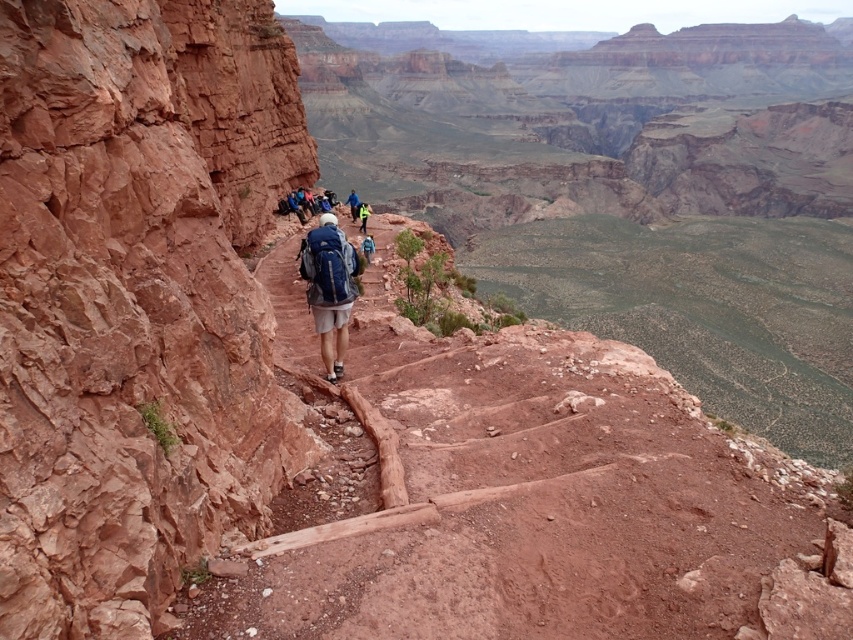
Can you confirm if matte blue backpack at center is thinner than blue backpack at center?

No, matte blue backpack at center is not thinner than blue backpack at center.

From the picture: Which of these two, matte blue backpack at center or blue backpack at center, stands taller?

Standing taller between the two is matte blue backpack at center.

Describe the element at coordinates (329, 289) in the screenshot. I see `matte blue backpack at center` at that location.

You are a GUI agent. You are given a task and a screenshot of the screen. Output one action in this format:
    pyautogui.click(x=<x>, y=<y>)
    Task: Click on the matte blue backpack at center
    The width and height of the screenshot is (853, 640).
    Given the screenshot: What is the action you would take?
    pyautogui.click(x=329, y=289)

Consider the image. Measure the distance between point (245, 204) and camera.

Point (245, 204) is 54.68 meters from camera.

Which is behind, point (113, 131) or point (363, 212)?

The point (363, 212) is behind.

Locate an element on the screen. The image size is (853, 640). rustic rock cliff at left is located at coordinates (136, 298).

Who is shorter, matte blue backpack at center or reflective blue jacket at center?

reflective blue jacket at center is shorter.

Is matte blue backpack at center taller than reflective blue jacket at center?

Yes, matte blue backpack at center is taller than reflective blue jacket at center.

Between point (320, 333) and point (358, 214), which one is positioned behind?

The point (358, 214) is more distant.

I want to click on matte blue backpack at center, so click(329, 289).